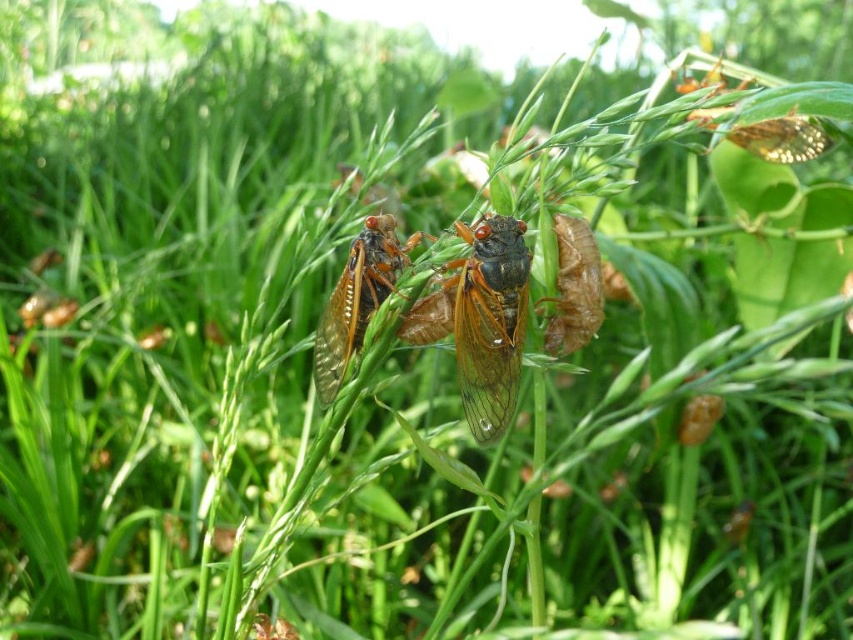
Does translucent amber wings at center have a greater width compared to translucent brown cicada at center?

Incorrect, translucent amber wings at center's width does not surpass translucent brown cicada at center's.

Between translucent amber wings at center and translucent brown cicada at center, which one is positioned higher?

Positioned higher is translucent brown cicada at center.

Is point (489, 284) positioned in front of point (329, 337)?

Yes, it is.

You are a GUI agent. You are given a task and a screenshot of the screen. Output one action in this format:
    pyautogui.click(x=<x>, y=<y>)
    Task: Click on the translucent amber wings at center
    Image resolution: width=853 pixels, height=640 pixels.
    Given the screenshot: What is the action you would take?
    pyautogui.click(x=490, y=321)